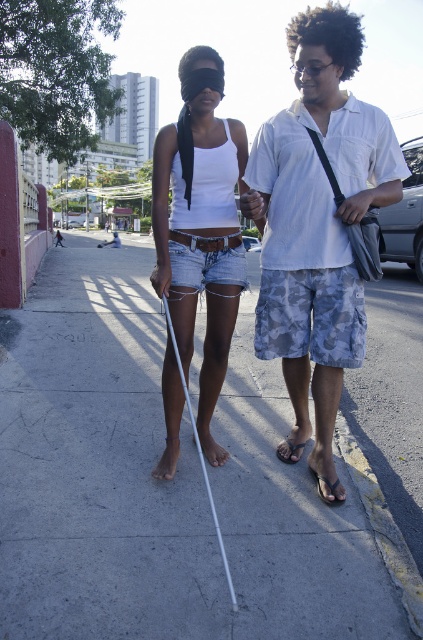
Question: Which object appears farthest from the camera in this image?

Choices:
 (A) white matte blindfold at center
 (B) black leather sandal at lower center
 (C) gray concrete sidewalk at center
 (D) white cotton shirt at center

Answer: (A)

Question: Is gray concrete sidewalk at center to the left of white cotton shirt at center from the viewer's perspective?

Choices:
 (A) no
 (B) yes

Answer: (B)

Question: Does white cotton shirt at center have a smaller size compared to black leather sandal at lower center?

Choices:
 (A) yes
 (B) no

Answer: (B)

Question: Which is farther from the gray concrete sidewalk at center?

Choices:
 (A) brown leather sandal at lower center
 (B) white matte blindfold at center
 (C) white cotton shirt at center

Answer: (A)

Question: Which object is closer to the camera taking this photo?

Choices:
 (A) gray concrete sidewalk at center
 (B) white matte blindfold at center

Answer: (A)

Question: Does gray concrete sidewalk at center appear over brown leather sandal at lower center?

Choices:
 (A) yes
 (B) no

Answer: (A)